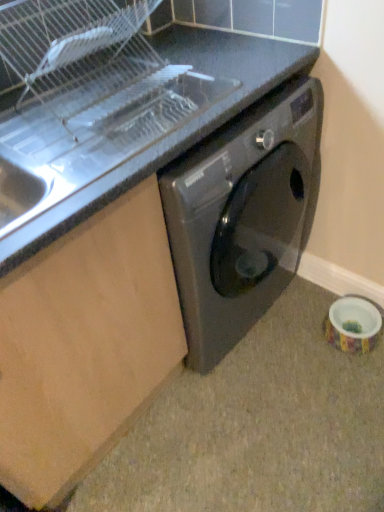
Question: From their relative heights in the image, would you say metallic stainless steel sink at upper left is taller or shorter than matte gray granite at lower right?

Choices:
 (A) short
 (B) tall

Answer: (B)

Question: Would you say metallic stainless steel sink at upper left is to the left or to the right of matte gray granite at lower right in the picture?

Choices:
 (A) left
 (B) right

Answer: (A)

Question: From a real-world perspective, relative to matte gray granite at lower right, is metallic stainless steel sink at upper left vertically above or below?

Choices:
 (A) above
 (B) below

Answer: (A)

Question: Looking at their shapes, would you say matte gray granite at lower right is wider or thinner than metallic stainless steel sink at upper left?

Choices:
 (A) thin
 (B) wide

Answer: (B)

Question: Is matte gray granite at lower right bigger or smaller than metallic stainless steel sink at upper left?

Choices:
 (A) big
 (B) small

Answer: (B)

Question: Does point (271, 349) appear closer or farther from the camera than point (225, 59)?

Choices:
 (A) farther
 (B) closer

Answer: (A)

Question: Which is correct: matte gray granite at lower right is inside metallic stainless steel sink at upper left, or outside of it?

Choices:
 (A) outside
 (B) inside

Answer: (A)